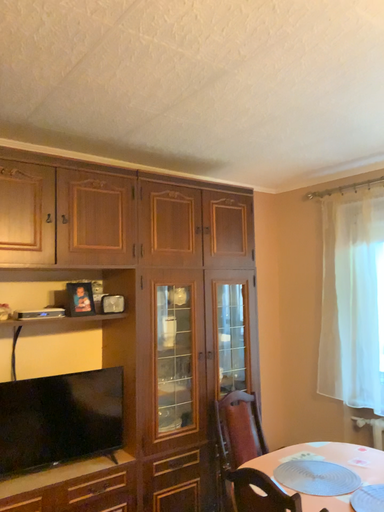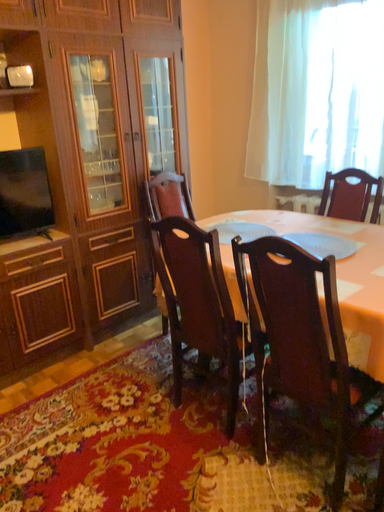
Question: Which way did the camera rotate in the video?

Choices:
 (A) rotated upward
 (B) rotated downward

Answer: (B)